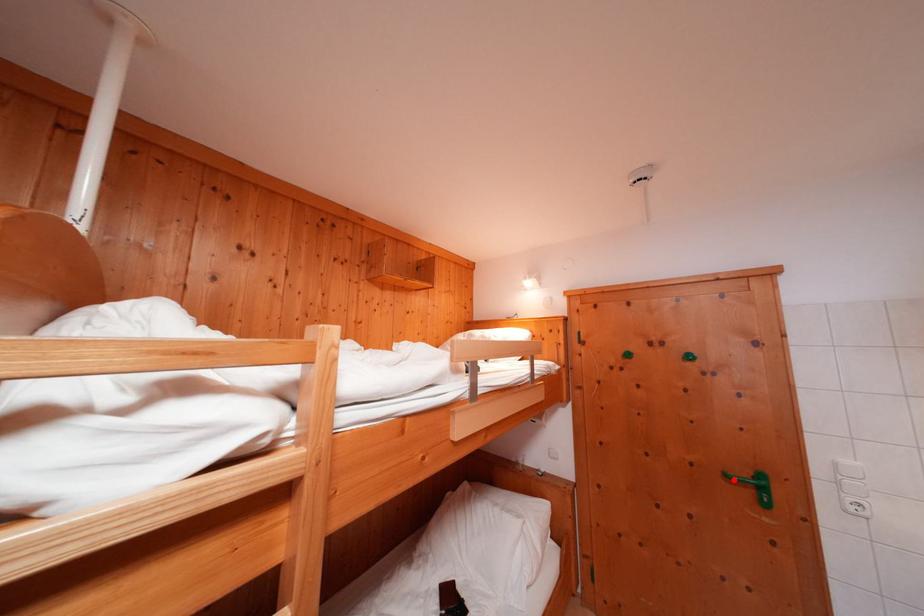
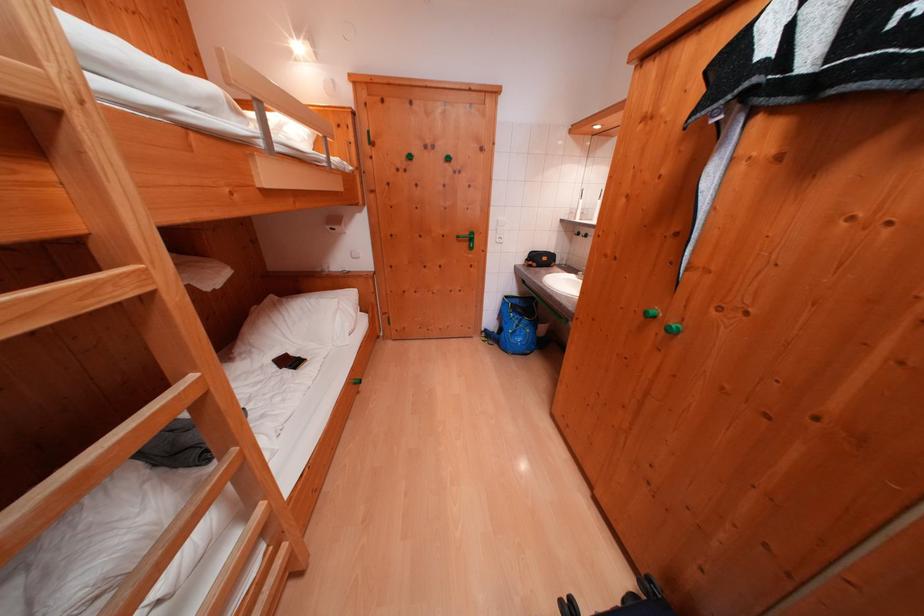
Question: I am providing you with two images of the same scene from different viewpoints. Image1 has a red point marked. In image2, the corresponding 3D location appears at what relative position? Reply with the corresponding letter.

Choices:
 (A) Closer
 (B) Farther

Answer: (A)